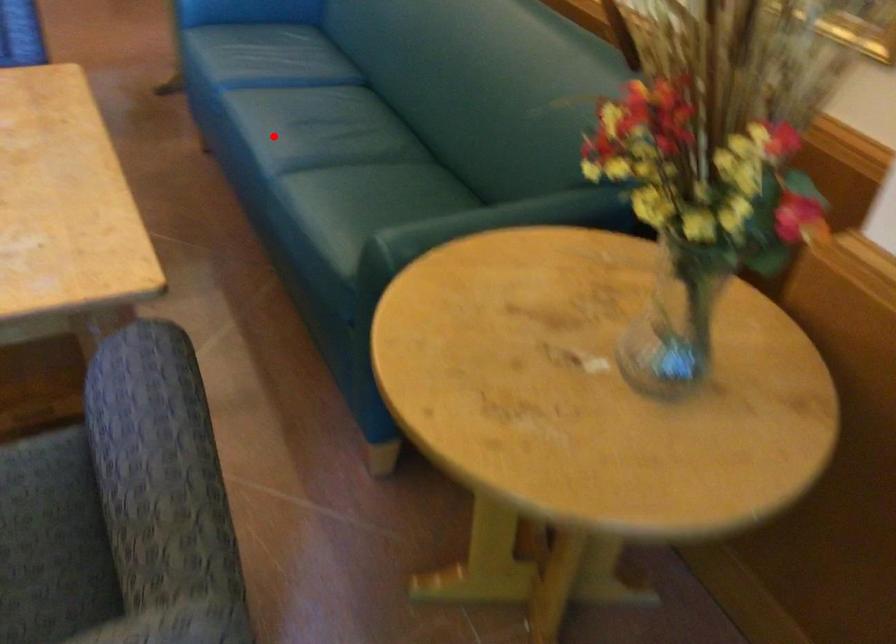
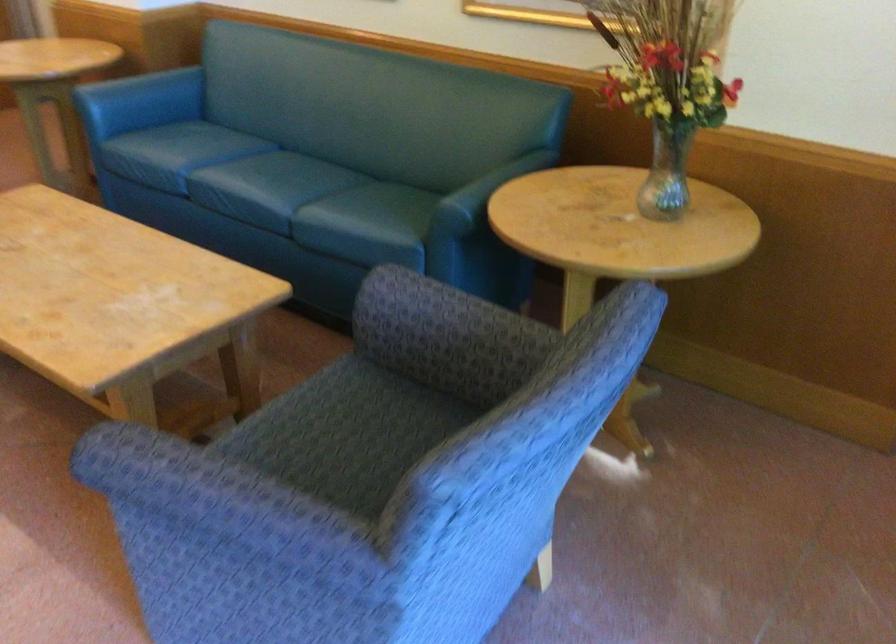
Question: I am providing you with two images of the same scene from different viewpoints. Given a red point in image1, look at the same physical point in image2. Is it:

Choices:
 (A) Closer to the viewpoint
 (B) Farther from the viewpoint

Answer: (B)